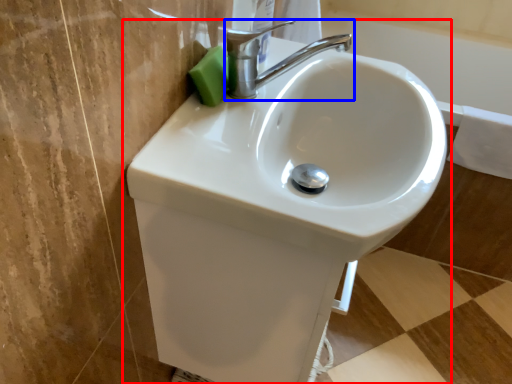
Question: Which object is closer to the camera taking this photo, sink (highlighted by a red box) or tap (highlighted by a blue box)?

Choices:
 (A) sink
 (B) tap

Answer: (A)